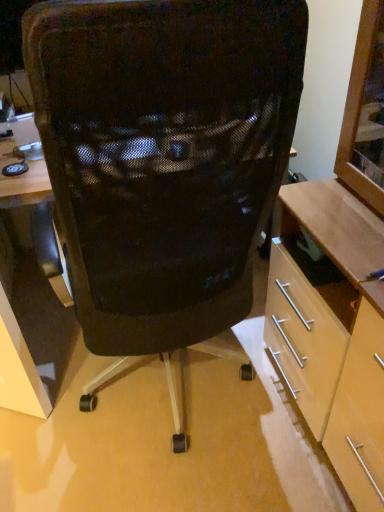
This screenshot has width=384, height=512. In order to click on free space that is to the left of black mesh chair at center in this screenshot , I will do `click(49, 389)`.